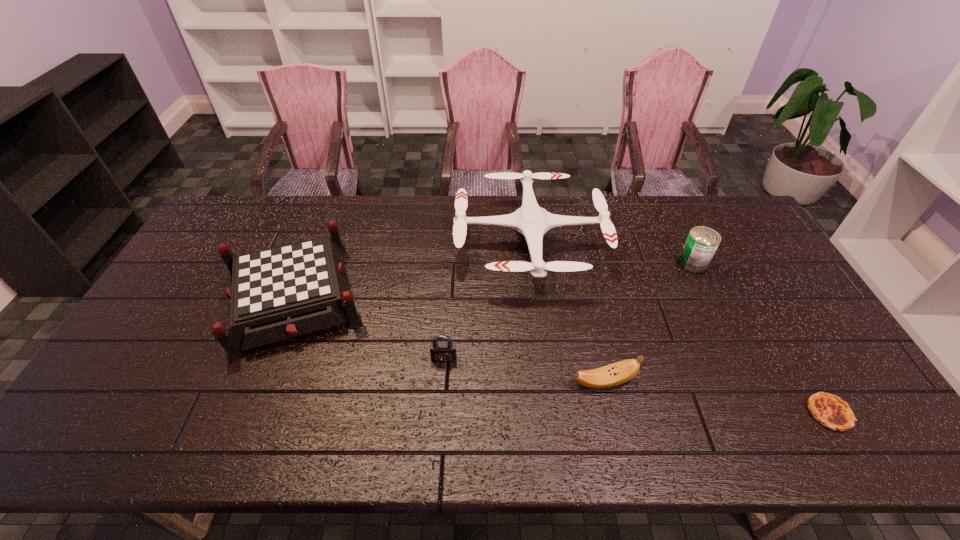
The height and width of the screenshot is (540, 960). I want to click on free point located on the right of the checkerboard, so click(x=491, y=298).

Where is `vacant space located on the back of the second object from right to left`? The image size is (960, 540). vacant space located on the back of the second object from right to left is located at coordinates (660, 197).

Identify the location of vacant point located 0.230m on the right of the fifth farthest object. [x=726, y=382].

You are a GUI agent. You are given a task and a screenshot of the screen. Output one action in this format:
    pyautogui.click(x=<x>, y=<y>)
    Task: Click on the blank space located 0.180m on the front of the padlock near the keyhole
    The width and height of the screenshot is (960, 540).
    Given the screenshot: What is the action you would take?
    pyautogui.click(x=439, y=429)

You are a GUI agent. You are given a task and a screenshot of the screen. Output one action in this format:
    pyautogui.click(x=<x>, y=<y>)
    Task: Click on the free space located on the back of the quiche
    The height and width of the screenshot is (540, 960).
    Given the screenshot: What is the action you would take?
    pyautogui.click(x=791, y=348)

What are the coordinates of `object that is at the far edge` in the screenshot? It's located at (531, 221).

The height and width of the screenshot is (540, 960). In order to click on object at the near edge in this screenshot , I will do `click(829, 410)`.

At what (x,y) coordinates should I click in order to perform the action: click on object that is at the right edge. Please return your answer as a coordinate pair (x, y). This screenshot has width=960, height=540. Looking at the image, I should click on (829, 410).

In order to click on object that is at the near right corner in this screenshot , I will do `click(829, 410)`.

Locate an element on the screen. The image size is (960, 540). vacant area at the far edge of the desktop is located at coordinates (431, 211).